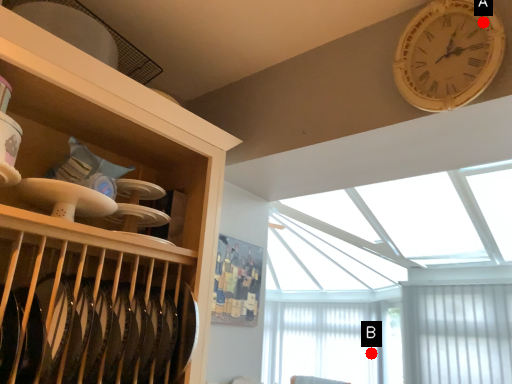
Question: Two points are circled on the image, labeled by A and B beside each circle. Which point is closer to the camera?

Choices:
 (A) A is closer
 (B) B is closer

Answer: (A)